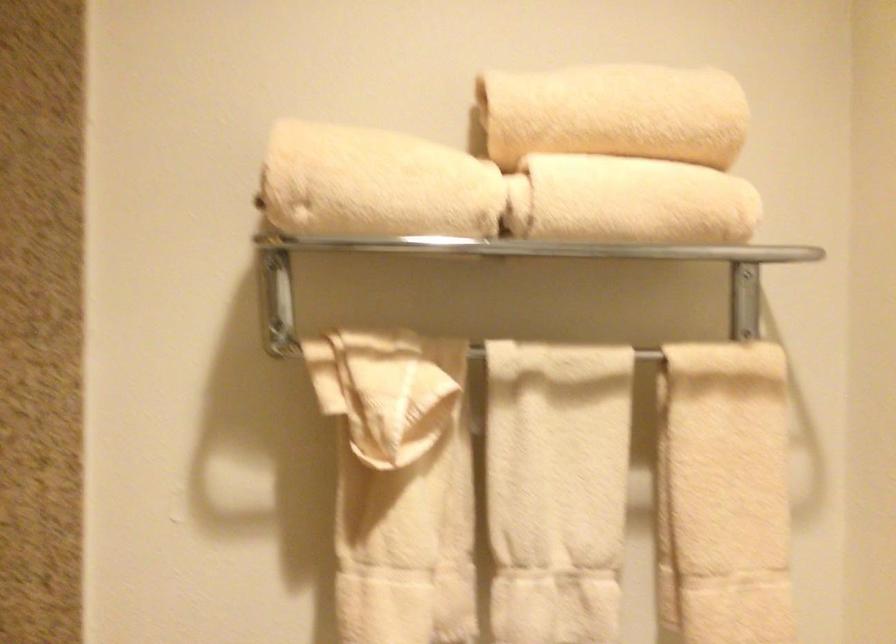
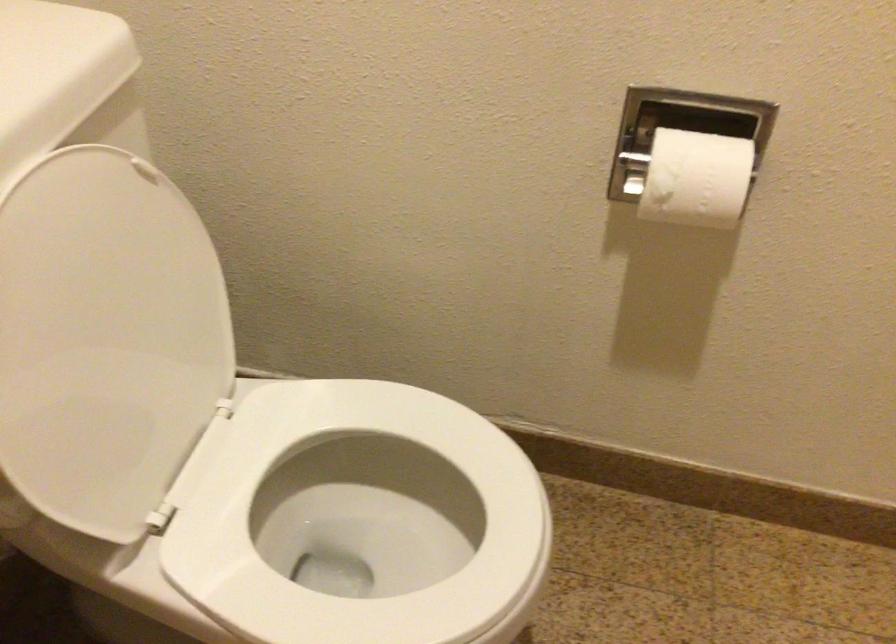
How did the camera likely rotate?

The camera rotated toward right-down.